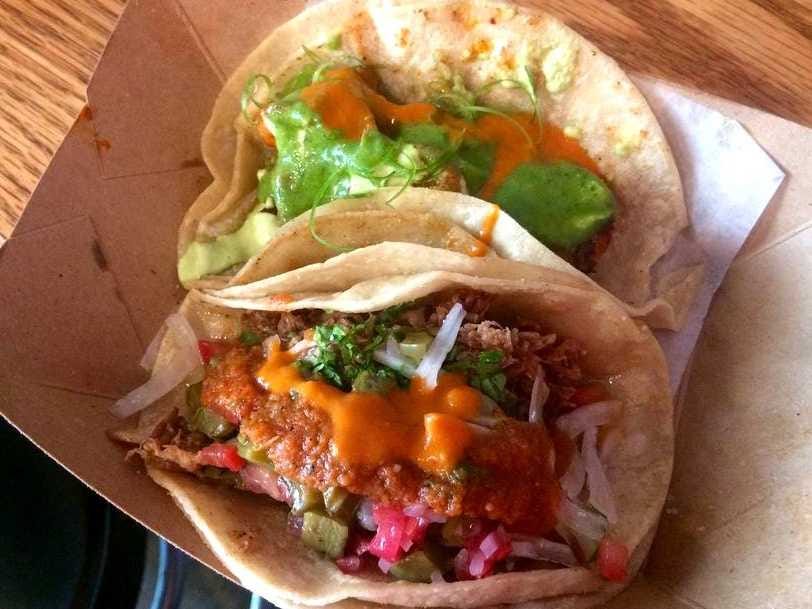
Image resolution: width=812 pixels, height=609 pixels. I want to click on grease stain, so pyautogui.click(x=98, y=257), pyautogui.click(x=187, y=162), pyautogui.click(x=91, y=117), pyautogui.click(x=98, y=143).